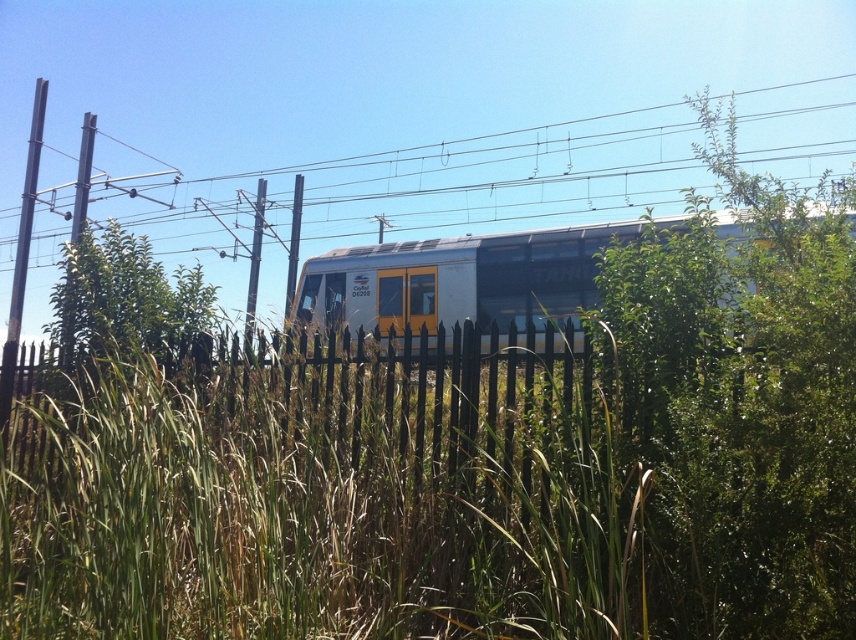
Question: Among these points, which one is farthest from the camera?

Choices:
 (A) (117, 314)
 (B) (809, 212)
 (C) (4, 420)

Answer: (C)

Question: Which of the following is the farthest from the observer?

Choices:
 (A) black metal fence at center
 (B) metallic wire at upper center
 (C) green leafy tree at center
 (D) silver metallic train at center

Answer: (B)

Question: Can you confirm if green leafy tree at center is wider than smooth metal pole at left?

Choices:
 (A) yes
 (B) no

Answer: (B)

Question: Does black metal fence at center have a smaller size compared to silver metallic train at center?

Choices:
 (A) yes
 (B) no

Answer: (A)

Question: Which point is closer to the camera taking this photo?

Choices:
 (A) (484, 244)
 (B) (70, 348)
 (C) (40, 182)
 (D) (15, 336)

Answer: (B)

Question: Does silver metallic train at center appear on the left side of green leafy tree at center?

Choices:
 (A) no
 (B) yes

Answer: (A)